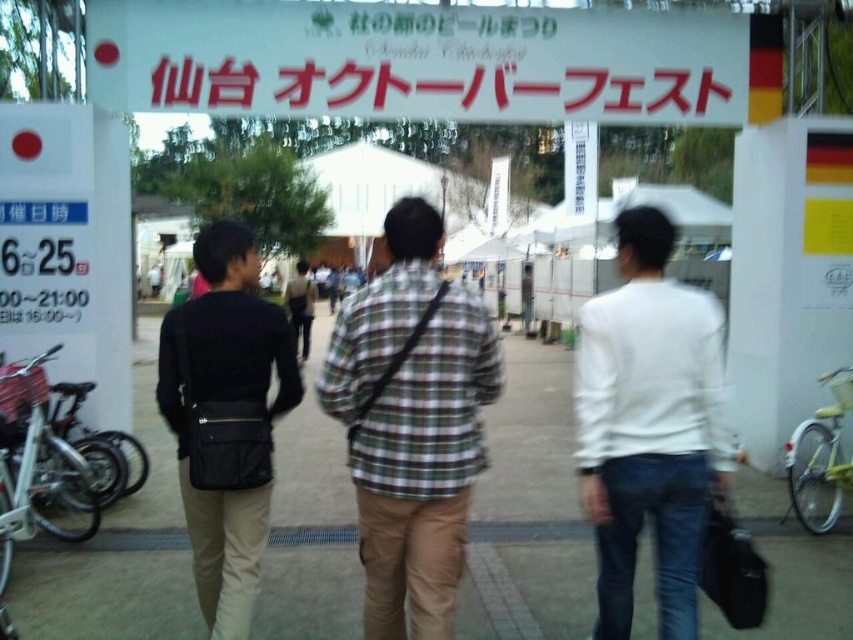
Does concrete pavement at center appear on the left side of white paper sign at upper center?

Yes, concrete pavement at center is to the left of white paper sign at upper center.

Can you confirm if concrete pavement at center is thinner than white paper sign at upper center?

In fact, concrete pavement at center might be wider than white paper sign at upper center.

The height and width of the screenshot is (640, 853). I want to click on concrete pavement at center, so click(x=527, y=512).

Who is positioned more to the left, white paper sign at upper center or black leather bag at center?

From the viewer's perspective, black leather bag at center appears more on the left side.

Based on the photo, between white paper sign at upper center and black leather bag at center, which one has less height?

Standing shorter between the two is white paper sign at upper center.

Is point (270, 29) behind point (219, 262)?

That is True.

You are a GUI agent. You are given a task and a screenshot of the screen. Output one action in this format:
    pyautogui.click(x=<x>, y=<y>)
    Task: Click on the white paper sign at upper center
    
    Given the screenshot: What is the action you would take?
    416,61

Can you confirm if concrete pavement at center is positioned to the right of white matte shirt at center?

Incorrect, concrete pavement at center is not on the right side of white matte shirt at center.

The image size is (853, 640). I want to click on concrete pavement at center, so click(527, 512).